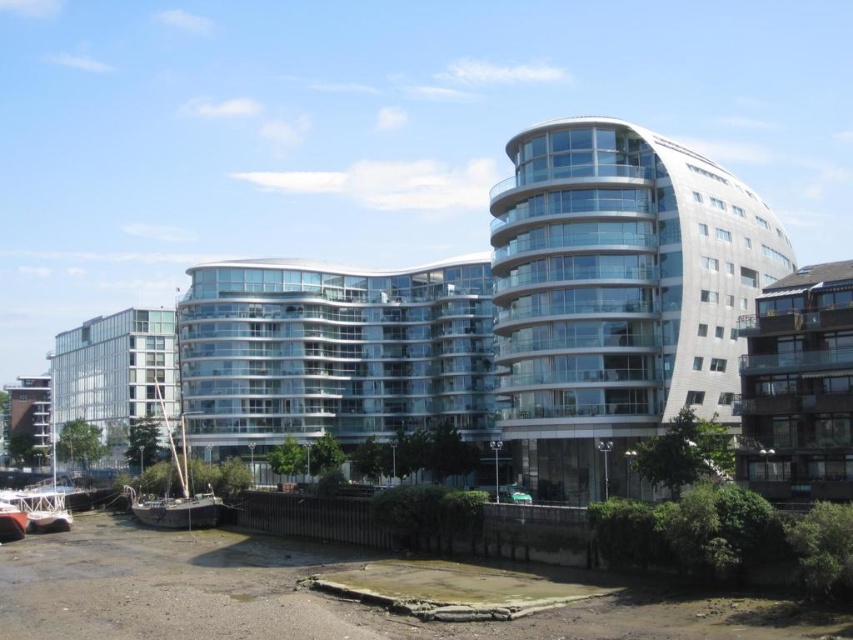
Question: Considering the real-world distances, which object is closest to the clear glass building at left?

Choices:
 (A) wooden boat at lower left
 (B) matte white building at lower left
 (C) rusty wooden boat at lower left

Answer: (C)

Question: From the image, what is the correct spatial relationship of clear glass building at left in relation to wooden boat at lower left?

Choices:
 (A) above
 (B) below

Answer: (A)

Question: Which object appears closest to the camera in this image?

Choices:
 (A) brown wooden balcony at right
 (B) glassy white building at center

Answer: (A)

Question: Is clear glass building at left smaller than rusty wooden boat at lower left?

Choices:
 (A) yes
 (B) no

Answer: (B)

Question: Is clear glass building at left in front of rusty wooden boat at lower left?

Choices:
 (A) no
 (B) yes

Answer: (A)

Question: Which object is the closest to the wooden boat at lower left?

Choices:
 (A) brown wooden balcony at right
 (B) glassy white building at center

Answer: (B)